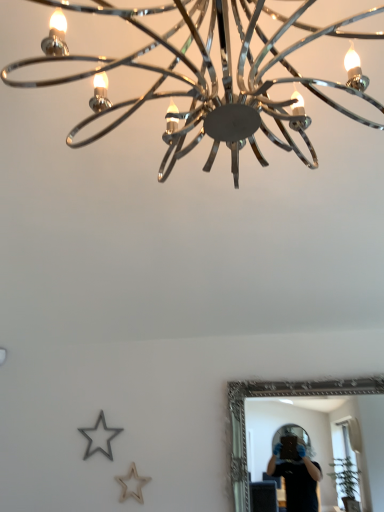
Question: Is chrome/metallic chandelier at upper center shorter than silver/golden metallic mirror at lower right?

Choices:
 (A) yes
 (B) no

Answer: (B)

Question: Is chrome/metallic chandelier at upper center closer to the viewer compared to silver/golden metallic mirror at lower right?

Choices:
 (A) no
 (B) yes

Answer: (B)

Question: Considering the relative sizes of chrome/metallic chandelier at upper center and silver/golden metallic mirror at lower right in the image provided, is chrome/metallic chandelier at upper center bigger than silver/golden metallic mirror at lower right?

Choices:
 (A) no
 (B) yes

Answer: (B)

Question: Considering the relative positions of chrome/metallic chandelier at upper center and silver/golden metallic mirror at lower right in the image provided, is chrome/metallic chandelier at upper center to the left of silver/golden metallic mirror at lower right from the viewer's perspective?

Choices:
 (A) no
 (B) yes

Answer: (B)

Question: From the image's perspective, is chrome/metallic chandelier at upper center under silver/golden metallic mirror at lower right?

Choices:
 (A) no
 (B) yes

Answer: (A)

Question: Is chrome/metallic chandelier at upper center directly adjacent to silver/golden metallic mirror at lower right?

Choices:
 (A) yes
 (B) no

Answer: (B)

Question: Would you say chrome/metallic chandelier at upper center is part of silver/golden metallic mirror at lower right's contents?

Choices:
 (A) yes
 (B) no

Answer: (B)

Question: From a real-world perspective, is silver/golden metallic mirror at lower right located beneath chrome/metallic chandelier at upper center?

Choices:
 (A) yes
 (B) no

Answer: (A)

Question: Is silver/golden metallic mirror at lower right placed right next to chrome/metallic chandelier at upper center?

Choices:
 (A) yes
 (B) no

Answer: (B)

Question: Is silver/golden metallic mirror at lower right at the left side of chrome/metallic chandelier at upper center?

Choices:
 (A) no
 (B) yes

Answer: (A)

Question: Does silver/golden metallic mirror at lower right have a smaller size compared to chrome/metallic chandelier at upper center?

Choices:
 (A) yes
 (B) no

Answer: (A)

Question: Is silver/golden metallic mirror at lower right turned away from chrome/metallic chandelier at upper center?

Choices:
 (A) yes
 (B) no

Answer: (B)

Question: Is silver/golden metallic mirror at lower right situated inside chrome/metallic chandelier at upper center or outside?

Choices:
 (A) inside
 (B) outside

Answer: (B)